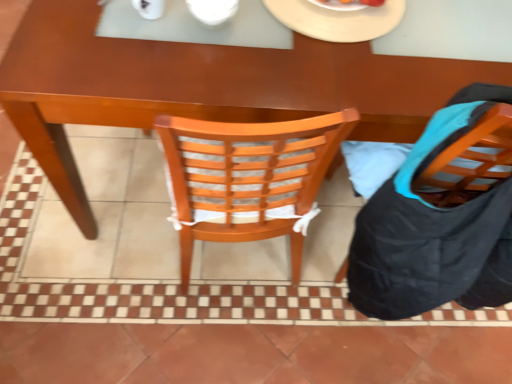
Question: Considering the relative positions of wooden chair at right and white matte plate at upper center in the image provided, is wooden chair at right to the right of white matte plate at upper center from the viewer's perspective?

Choices:
 (A) no
 (B) yes

Answer: (B)

Question: Is wooden chair at right taller than white matte plate at upper center?

Choices:
 (A) yes
 (B) no

Answer: (A)

Question: Can you confirm if wooden chair at right is wider than white matte plate at upper center?

Choices:
 (A) no
 (B) yes

Answer: (B)

Question: Is wooden chair at right located outside white matte plate at upper center?

Choices:
 (A) yes
 (B) no

Answer: (A)

Question: Considering the relative positions of wooden chair at right and white matte plate at upper center in the image provided, is wooden chair at right in front of white matte plate at upper center?

Choices:
 (A) yes
 (B) no

Answer: (A)

Question: Considering their positions, is brown wooden desk at center located in front of or behind wooden chair at right?

Choices:
 (A) behind
 (B) front

Answer: (A)

Question: In terms of size, does brown wooden desk at center appear bigger or smaller than wooden chair at right?

Choices:
 (A) big
 (B) small

Answer: (A)

Question: Is brown wooden desk at center taller or shorter than wooden chair at right?

Choices:
 (A) short
 (B) tall

Answer: (A)

Question: Is brown wooden desk at center inside the boundaries of wooden chair at right, or outside?

Choices:
 (A) outside
 (B) inside

Answer: (A)

Question: Choose the correct answer: Is brown wooden desk at center inside white glossy bowl at upper center or outside it?

Choices:
 (A) outside
 (B) inside

Answer: (A)

Question: Is brown wooden desk at center taller or shorter than white glossy bowl at upper center?

Choices:
 (A) tall
 (B) short

Answer: (A)

Question: From a real-world perspective, relative to white glossy bowl at upper center, is brown wooden desk at center vertically above or below?

Choices:
 (A) below
 (B) above

Answer: (A)

Question: Based on their positions, is brown wooden desk at center located to the left or right of white glossy bowl at upper center?

Choices:
 (A) left
 (B) right

Answer: (B)

Question: From a real-world perspective, is white matte plate at upper center positioned above or below white glossy bowl at upper center?

Choices:
 (A) above
 (B) below

Answer: (B)

Question: Do you think white matte plate at upper center is within white glossy bowl at upper center, or outside of it?

Choices:
 (A) outside
 (B) inside

Answer: (A)